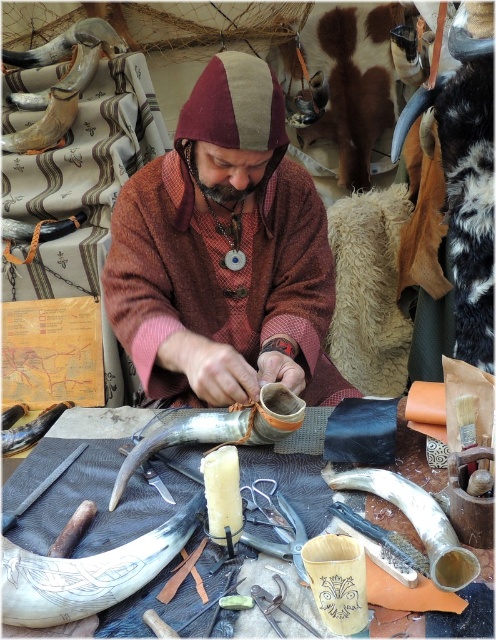
You are a customer in a market stall where this craftsman is working. You want to place a small decorative item between the smooth horn at center and the shiny silver horn at lower right. What is the minimum length of the item to ensure it can fit snugly between them without overlapping either horn?

The smooth horn at center and shiny silver horn at lower right are 8.70 inches apart from each other. Therefore, the minimum length of the item should be just under 8.70 inches to fit snugly between them without overlapping either horn.

You are a customer looking to buy a horn for a traditional ceremony. You see the carved bone horn at lower left and the smooth horn at center. Which one is taller?

The smooth horn at center is taller than the carved bone horn at lower left.

You are a customer in a medieval market and see the craftsman working on the matte brown leather boot at center and the smooth horn at center. Which object on the table is larger in size?

The matte brown leather boot at center is larger than the smooth horn at center.